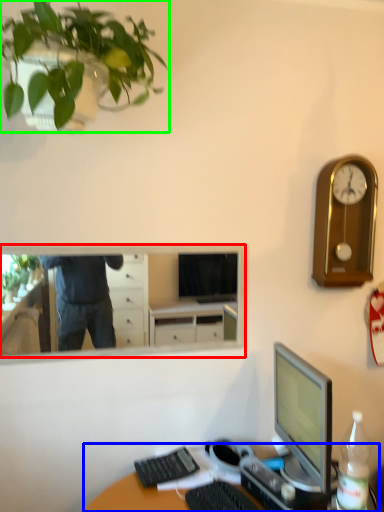
Question: Which object is the farthest from mirror (highlighted by a red box)? Choose among these: desk (highlighted by a blue box) or houseplant (highlighted by a green box).

Choices:
 (A) desk
 (B) houseplant

Answer: (B)